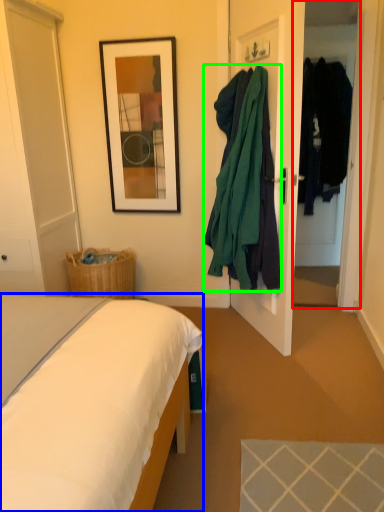
Question: Based on their relative distances, which object is farther from glass door (highlighted by a red box)? Choose from bed (highlighted by a blue box) and clothing (highlighted by a green box).

Choices:
 (A) bed
 (B) clothing

Answer: (A)